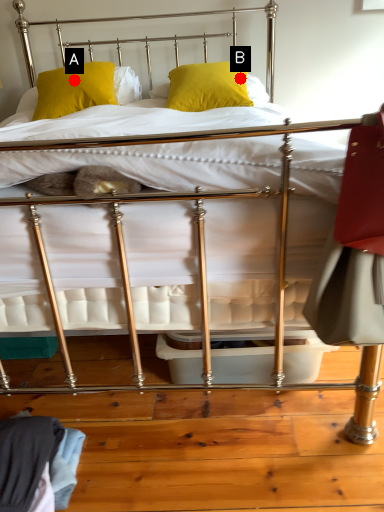
Question: Two points are circled on the image, labeled by A and B beside each circle. Which point is further to the camera?

Choices:
 (A) A is further
 (B) B is further

Answer: (A)